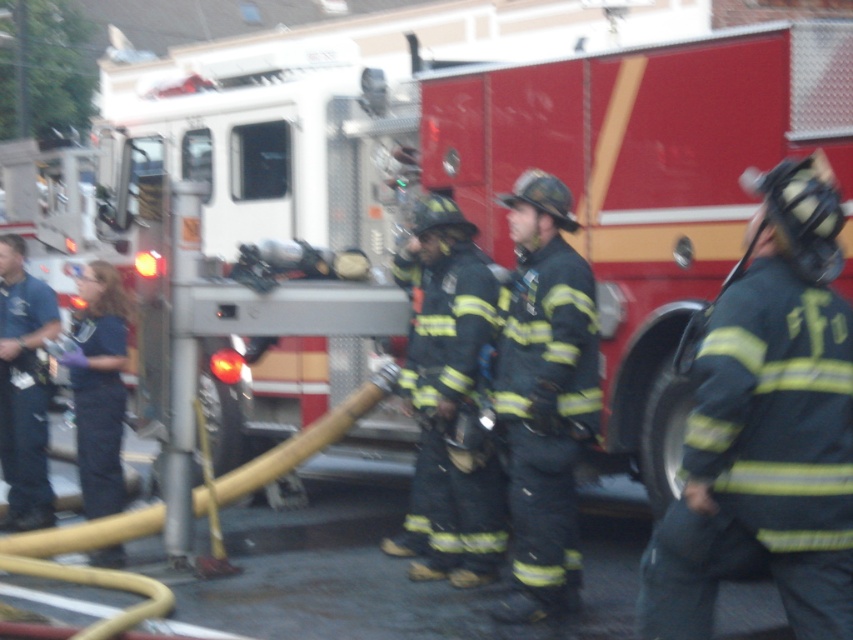
You are a firefighter observing the scene. You need to quickly identify which uniform is closer to you. Which one is in front between the dark blue uniform at center and the black matte uniform at center?

The dark blue uniform at center is in front of the black matte uniform at center, so the dark blue uniform at center is closer to you.

You are a firefighter needing to choose between the dark gray uniform at center and the black matte uniform at center for a rescue mission. Which uniform is more suitable if you need a thinner material for easier movement?

The dark gray uniform at center is thinner than the black matte uniform at center, making it more suitable for easier movement during the rescue mission.

You are a firefighter trying to locate your dark gray uniform at center in the scene. The scene has a fire truck with an extended ladder in the background. Where would you look relative to the fire truck?

The dark gray uniform at center is located at point 0.667 on the x axis and 0.899 on the y axis, which is to the right and slightly below the fire truck in the scene.